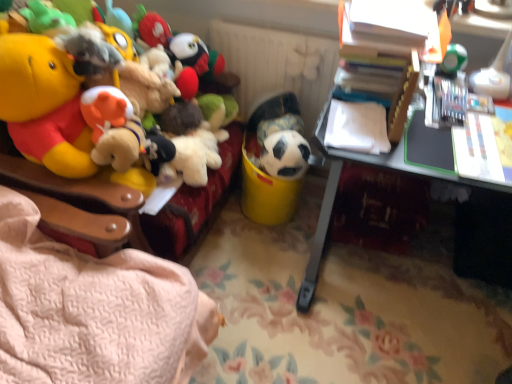
Question: Considering the relative sizes of white matte radiator at upper center and green matte die at upper right, arranged as the fourth toy when viewed from the left, in the image provided, is white matte radiator at upper center bigger than green matte die at upper right, arranged as the fourth toy when viewed from the left,?

Choices:
 (A) no
 (B) yes

Answer: (B)

Question: From a real-world perspective, is white matte radiator at upper center on top of green matte die at upper right, which is counted as the 1th toy, starting from the right?

Choices:
 (A) yes
 (B) no

Answer: (B)

Question: Would you say green matte die at upper right, arranged as the fourth toy when viewed from the left, is part of white matte radiator at upper center's contents?

Choices:
 (A) yes
 (B) no

Answer: (B)

Question: Is green matte die at upper right, which is counted as the 1th toy, starting from the right, at the back of white matte radiator at upper center?

Choices:
 (A) no
 (B) yes

Answer: (A)

Question: Is white matte radiator at upper center further to the viewer compared to green matte die at upper right, which is counted as the 1th toy, starting from the right?

Choices:
 (A) no
 (B) yes

Answer: (B)

Question: From the image's perspective, is black matte soccer ball at center, marked as the third toy in a left-to-right arrangement, above or below soccer ball at center, the 2th toy in the left-to-right sequence?

Choices:
 (A) below
 (B) above

Answer: (A)

Question: Considering their positions, is black matte soccer ball at center, marked as the third toy in a left-to-right arrangement, located in front of or behind soccer ball at center, the 2th toy in the left-to-right sequence?

Choices:
 (A) front
 (B) behind

Answer: (A)

Question: Based on their sizes in the image, would you say black matte soccer ball at center, marked as the third toy in a left-to-right arrangement, is bigger or smaller than soccer ball at center, the 2th toy in the left-to-right sequence?

Choices:
 (A) big
 (B) small

Answer: (B)

Question: Considering the positions of point (287, 168) and point (272, 97), is point (287, 168) closer or farther from the camera than point (272, 97)?

Choices:
 (A) closer
 (B) farther

Answer: (A)

Question: Is white plastic desk at right wider or thinner than green matte die at upper right, arranged as the fourth toy when viewed from the left?

Choices:
 (A) wide
 (B) thin

Answer: (A)

Question: Considering the relative positions of white plastic desk at right and green matte die at upper right, which is counted as the 1th toy, starting from the right, in the image provided, is white plastic desk at right to the left or to the right of green matte die at upper right, which is counted as the 1th toy, starting from the right,?

Choices:
 (A) left
 (B) right

Answer: (A)

Question: Would you say white plastic desk at right is inside or outside green matte die at upper right, arranged as the fourth toy when viewed from the left?

Choices:
 (A) inside
 (B) outside

Answer: (B)

Question: From a real-world perspective, is white plastic desk at right physically located above or below green matte die at upper right, which is counted as the 1th toy, starting from the right?

Choices:
 (A) below
 (B) above

Answer: (A)

Question: In terms of height, does soft plush toys at left, positioned as the 4th toy in right-to-left order, look taller or shorter compared to white matte radiator at upper center?

Choices:
 (A) short
 (B) tall

Answer: (B)

Question: From the image's perspective, is soft plush toys at left, acting as the first toy starting from the left, located above or below white matte radiator at upper center?

Choices:
 (A) below
 (B) above

Answer: (A)